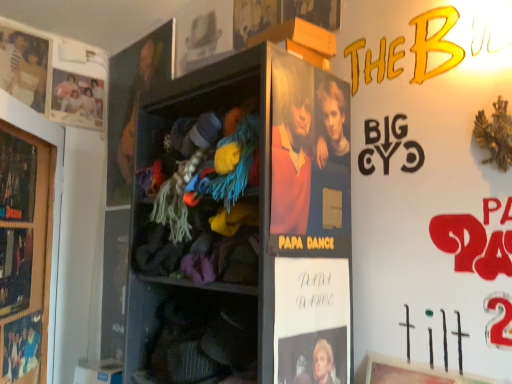
Question: Is matte black poster at left, which is counted as the 2th advertisement, starting from the right, outside of matte black guitar at upper left, the second person viewed from the right?

Choices:
 (A) yes
 (B) no

Answer: (A)

Question: Does matte black poster at left, arranged as the 2th advertisement when viewed from the left, have a greater height compared to matte black guitar at upper left, positioned as the 2th person in back-to-front order?

Choices:
 (A) no
 (B) yes

Answer: (A)

Question: Does matte black poster at left, arranged as the 2th advertisement when viewed from the left, appear on the right side of matte black guitar at upper left, positioned as the 2th person in back-to-front order?

Choices:
 (A) yes
 (B) no

Answer: (B)

Question: Can you confirm if matte black poster at left, arranged as the 2th advertisement when viewed from the left, is bigger than matte black guitar at upper left, positioned as the 2th person in back-to-front order?

Choices:
 (A) no
 (B) yes

Answer: (A)

Question: Considering the relative sizes of matte black poster at left, arranged as the 2th advertisement when viewed from the left, and matte black guitar at upper left, the second person viewed from the right, in the image provided, is matte black poster at left, arranged as the 2th advertisement when viewed from the left, smaller than matte black guitar at upper left, the second person viewed from the right,?

Choices:
 (A) no
 (B) yes

Answer: (B)

Question: From the image's perspective, is wooden shelf at center located above or below matte black poster at center, the first advertisement from the right?

Choices:
 (A) below
 (B) above

Answer: (B)

Question: Would you say wooden shelf at center is to the left or to the right of matte black poster at center, which appears as the third advertisement when viewed from the left, in the picture?

Choices:
 (A) right
 (B) left

Answer: (B)

Question: Is point (136, 203) closer or farther from the camera than point (287, 263)?

Choices:
 (A) farther
 (B) closer

Answer: (A)

Question: Looking at their shapes, would you say wooden shelf at center is wider or thinner than matte black poster at center, the first advertisement from the right?

Choices:
 (A) wide
 (B) thin

Answer: (A)

Question: From their relative heights in the image, would you say matte white family portrait at upper left, which is counted as the third person, starting from the right, is taller or shorter than wooden framed poster at left, the 1th advertisement from the left?

Choices:
 (A) tall
 (B) short

Answer: (B)

Question: Looking at the image, does matte white family portrait at upper left, positioned as the first person in left-to-right order, seem bigger or smaller compared to wooden framed poster at left, the third advertisement from the right?

Choices:
 (A) small
 (B) big

Answer: (A)

Question: Relative to wooden framed poster at left, the third advertisement from the right, is matte white family portrait at upper left, the 3th person when ordered from front to back, in front or behind?

Choices:
 (A) front
 (B) behind

Answer: (B)

Question: Is matte white family portrait at upper left, positioned as the first person in left-to-right order, wider or thinner than wooden framed poster at left, the 1th advertisement from the left?

Choices:
 (A) thin
 (B) wide

Answer: (A)

Question: Is matte paper poster at center, the 3th person viewed from the left, in front of or behind matte paper poster at upper left, which ranks as the second movie poster in bottom-to-top order, in the image?

Choices:
 (A) behind
 (B) front

Answer: (B)

Question: Considering the positions of matte paper poster at center, placed as the first person when sorted from right to left, and matte paper poster at upper left, marked as the first movie poster in a left-to-right arrangement, in the image, is matte paper poster at center, placed as the first person when sorted from right to left, bigger or smaller than matte paper poster at upper left, marked as the first movie poster in a left-to-right arrangement,?

Choices:
 (A) small
 (B) big

Answer: (A)